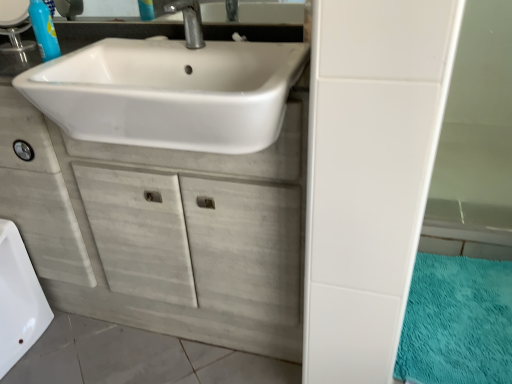
The image size is (512, 384). I want to click on vacant area that is situated to the right of metallic silver faucet at upper center, so point(256,43).